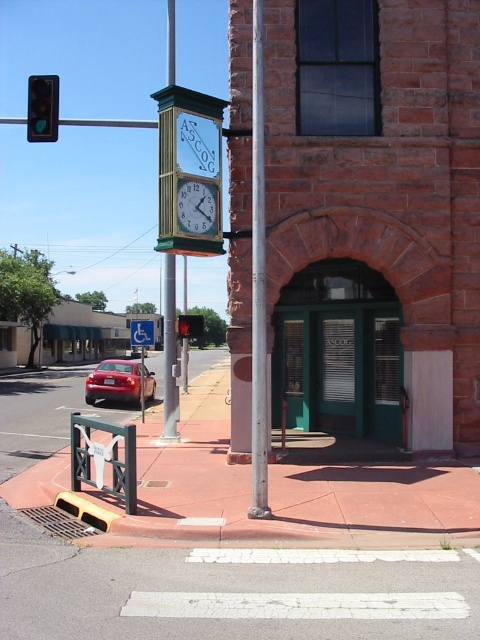
Is point (168, 56) positioned in front of point (204, 196)?

No, (168, 56) is further to viewer.

Can you confirm if green wood clock at center is shorter than green wooden clock at center?

In fact, green wood clock at center may be taller than green wooden clock at center.

Is point (166, 268) behind point (177, 224)?

Yes, point (166, 268) is behind point (177, 224).

You are a GUI agent. You are given a task and a screenshot of the screen. Output one action in this format:
    pyautogui.click(x=<x>, y=<y>)
    Task: Click on the green wood clock at center
    Image resolution: width=480 pixels, height=640 pixels.
    Given the screenshot: What is the action you would take?
    pyautogui.click(x=169, y=353)

Does smooth silver pole at center appear on the right side of green wood clock at center?

Correct, you'll find smooth silver pole at center to the right of green wood clock at center.

Is point (264, 241) more distant than point (177, 408)?

No, it is in front of (177, 408).

Where is `smooth silver pole at center`? smooth silver pole at center is located at coordinates (257, 282).

Locate an element on the screen. The height and width of the screenshot is (640, 480). smooth silver pole at center is located at coordinates (257, 282).

Does green wooden clock at center have a lesser width compared to green glass traffic light at left?

Correct, green wooden clock at center's width is less than green glass traffic light at left's.

Locate an element on the screen. The image size is (480, 640). green wooden clock at center is located at coordinates (196, 208).

At what (x,y) coordinates should I click in order to perform the action: click on green wooden clock at center. Please return your answer as a coordinate pair (x, y). Image resolution: width=480 pixels, height=640 pixels. Looking at the image, I should click on (196, 208).